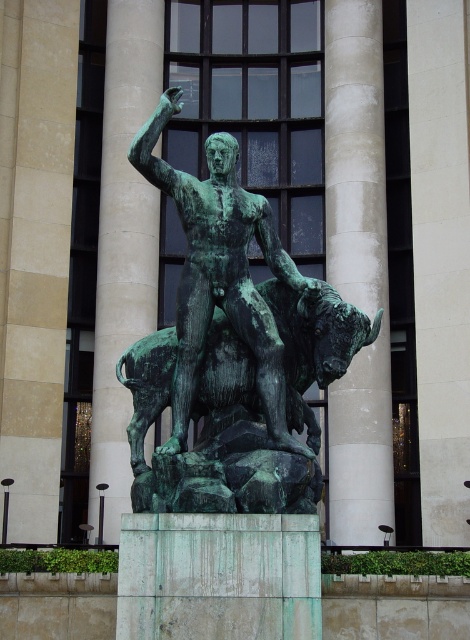
Is smooth stone pillar at center positioned before green patina statue at center?

No, smooth stone pillar at center is behind green patina statue at center.

Is smooth stone pillar at center shorter than green patina statue at center?

No, smooth stone pillar at center is not shorter than green patina statue at center.

Where is `smooth stone pillar at center`? smooth stone pillar at center is located at coordinates (354, 154).

Is point (120, 232) closer to camera compared to point (127, 154)?

No, it is not.

Is point (117, 160) more distant than point (186, 186)?

Yes, it is.

Locate an element on the screen. Image resolution: width=470 pixels, height=640 pixels. green marble pillar at center is located at coordinates (123, 243).

Between smooth stone pillar at center and green marble pillar at center, which one appears on the right side from the viewer's perspective?

smooth stone pillar at center is more to the right.

Is smooth stone pillar at center to the right of green marble pillar at center from the viewer's perspective?

Yes, smooth stone pillar at center is to the right of green marble pillar at center.

Is point (384, 260) positioned in front of point (133, 60)?

That is True.

Where is `smooth stone pillar at center`? This screenshot has height=640, width=470. smooth stone pillar at center is located at coordinates [354, 154].